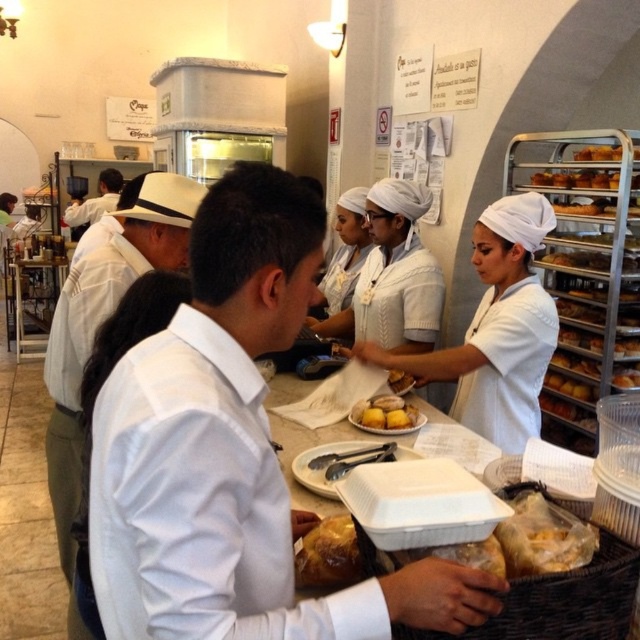
You are a customer at the bakery and want to place your hand between the yellow matte bread at center and the yellow matte cake at center. Can you fit your hand there?

The distance between the yellow matte bread at center and the yellow matte cake at center is 6.98 inches, which is more than enough space to fit your hand.

You are a customer at the bakery and want to choose between the yellow matte bread at center and the golden brown bread at center. Based on their positions, which one is closer to you?

The yellow matte bread at center is closer to you because it is positioned under the golden brown bread at center, indicating it is in front.

You are a customer at the bakery counter. You see two breads at the center of the counter. Which bread is closer to you, the yellow matte bread at center or the golden brown bread at center?

The yellow matte bread at center is closer to you since it is in front of the golden brown bread at center.